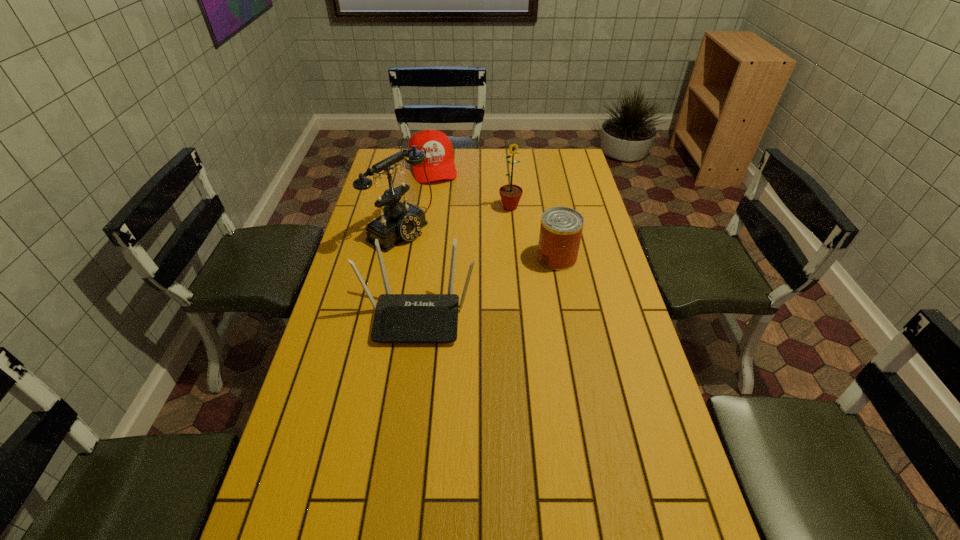
The height and width of the screenshot is (540, 960). In order to click on free area in between the sunflower and the third tallest object in this screenshot , I will do `click(464, 261)`.

The height and width of the screenshot is (540, 960). Find the location of `vacant point located between the rightmost object and the router`. vacant point located between the rightmost object and the router is located at coordinates (488, 286).

The width and height of the screenshot is (960, 540). In order to click on empty space that is in between the can and the nearest object in this screenshot , I will do `click(488, 286)`.

Identify the location of vacant area that lies between the telephone and the sunflower. The image size is (960, 540). (455, 218).

Locate an element on the screen. This screenshot has width=960, height=540. free space between the telephone and the sunflower is located at coordinates (455, 218).

Locate an element on the screen. This screenshot has width=960, height=540. vacant region between the sunflower and the telephone is located at coordinates (455, 218).

Image resolution: width=960 pixels, height=540 pixels. In order to click on blank region between the router and the baseball cap in this screenshot , I will do `click(425, 241)`.

The width and height of the screenshot is (960, 540). I want to click on vacant area that lies between the fourth object from left to right and the farthest object, so click(471, 187).

Identify which object is located as the second nearest to the baseball cap. Please provide its 2D coordinates. Your answer should be formatted as a tuple, i.e. [(x, y)], where the tuple contains the x and y coordinates of a point satisfying the conditions above.

[(510, 194)]

Find the location of `object that ranks as the second closest to the baseball cap`. object that ranks as the second closest to the baseball cap is located at coordinates (510, 194).